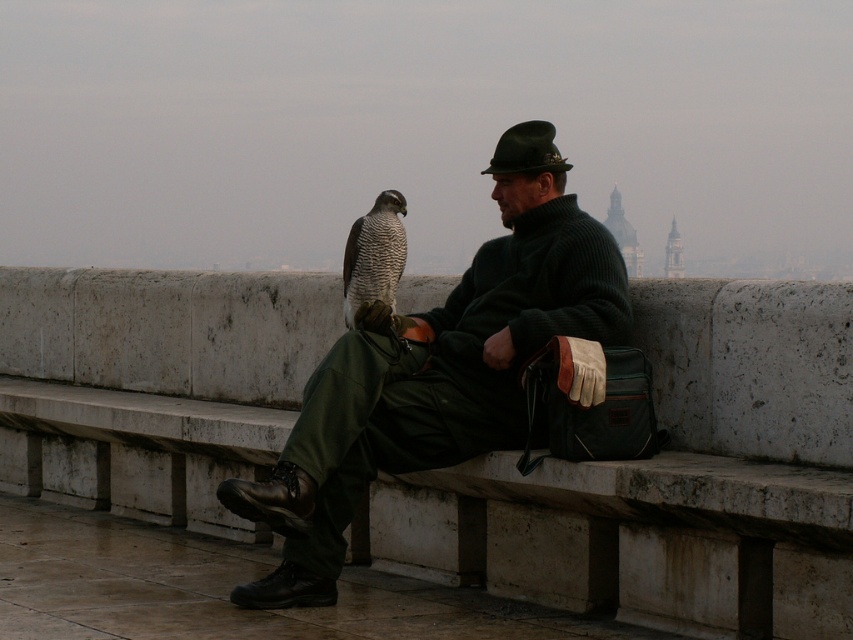
You are a photographer trying to capture a clear shot of both the speckled feathers falcon at center and the green felt hat at center. Which object should you focus on first to ensure it appears sharp in your photo?

You should focus on the speckled feathers falcon at center first because it is closer to you than the green felt hat at center, so focusing on it will ensure it appears sharp while the hat may be slightly blurred. Alternatively, adjust your focus point to a position between them for both to be in focus.

Consider the image. You are a tailor observing a man in a public space. You need to measure the distance between the matte green sweater at center and the green felt hat at center to determine if they are part of a matching set. Can you confirm if they are close enough to be considered part of the same outfit?

The matte green sweater at center and green felt hat at center are 3.55 meters apart, which is too far to be part of the same outfit.

You are a fashion designer observing the man in the image. You need to determine the layering order of his clothing items. Which clothing item, the matte green sweater at center or the green felt hat at center, is positioned closer to the viewer?

The matte green sweater at center is in front of the green felt hat at center, so the sweater is closer to the viewer.